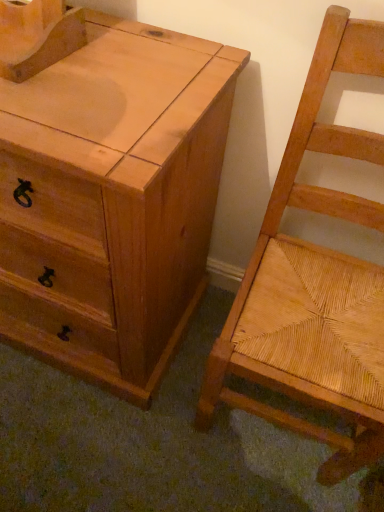
I want to click on free space to the left of natural wood woven seat at right, so click(150, 419).